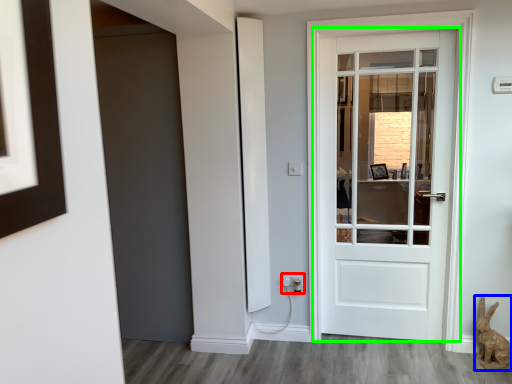
Question: Which is nearer to the electric outlet (highlighted by a red box)? animal (highlighted by a blue box) or door (highlighted by a green box).

Choices:
 (A) animal
 (B) door

Answer: (A)